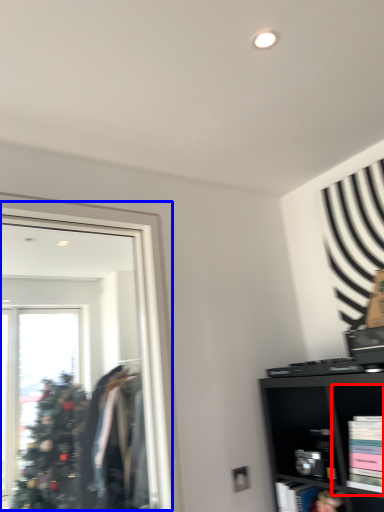
Question: Among these objects, which one is nearest to the camera, cabinet (highlighted by a red box) or mirror (highlighted by a blue box)?

Choices:
 (A) cabinet
 (B) mirror

Answer: (B)